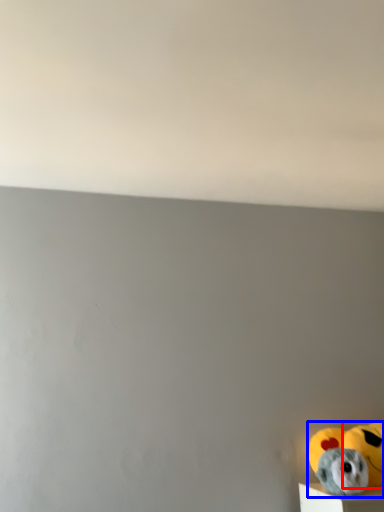
Question: Which object appears closest to the camera in this image, stuffed animal (highlighted by a red box) or toy (highlighted by a blue box)?

Choices:
 (A) stuffed animal
 (B) toy

Answer: (B)